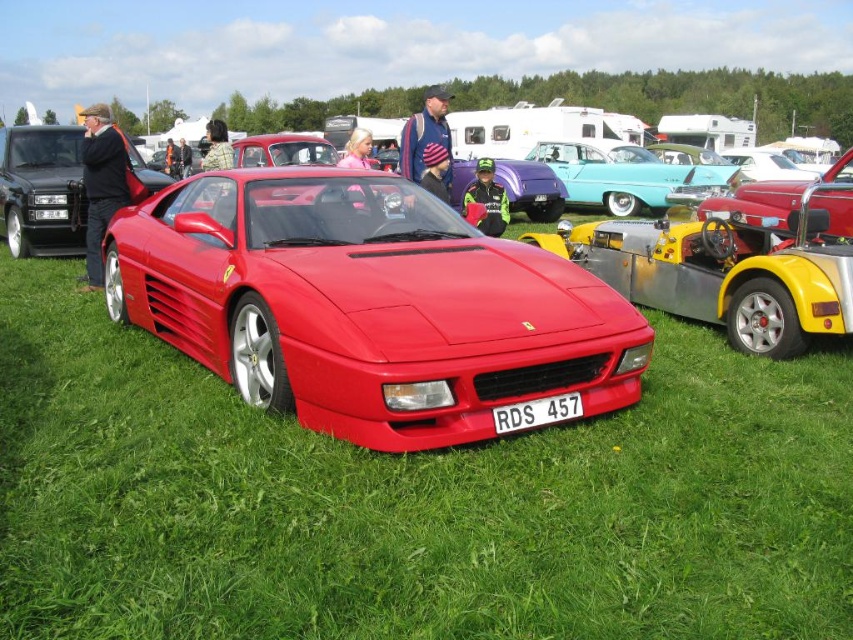
You are standing at the edge of the car show field and want to walk to the bright red Ferrari sports car. Which direction should you walk to reach the green grass at center where the Ferrari is parked?

Walk towards the green grass at center located at point coordinates (x=410, y=500) to reach the Ferrari.

You are at the car show and want to take a photo of both the shiny red ferrari at center and the glossy red car at center. Which one should you focus on first if you want to capture them both in the same frame without moving your camera?

The shiny red ferrari at center is positioned on the left side of glossy red car at center, so you should focus on the glossy red car at center first to ensure both are in the frame.

You are a photographer standing at the camera position. You want to take a photo of the Ferrari sports car in the foreground. Since the green grass at center is in the way, can you step back enough to capture the Ferrari without the grass blocking it?

The distance between the green grass at center and the camera is 2.63 meters. To avoid the grass blocking the Ferrari, you would need to step back further than 2.63 meters to ensure the grass is no longer in the foreground. However, without knowing the exact position of the Ferrari relative to the grass, it is uncertain if stepping back that distance would sufficiently frame the Ferrari without obstruction.